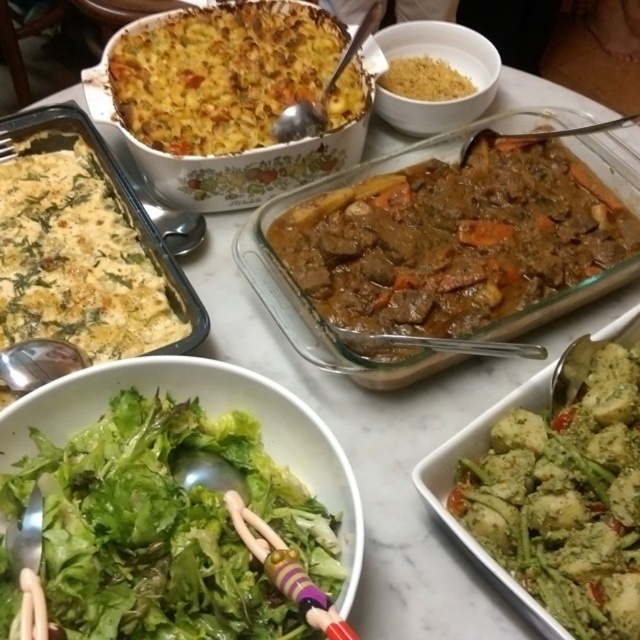
Question: Which of these objects is positioned farthest from the brown glossy stew at center?

Choices:
 (A) green leafy salad at center
 (B) yellow cheesy casserole at upper left
 (C) green pesto-coated potatoes at lower right

Answer: (A)

Question: Can you confirm if green leafy salad at center is positioned above brown crumbly at upper center?

Choices:
 (A) yes
 (B) no

Answer: (B)

Question: Can you confirm if green leafy salad at center is positioned above white creamy casserole at left?

Choices:
 (A) yes
 (B) no

Answer: (B)

Question: Among these points, which one is farthest from the camera?

Choices:
 (A) (468, 202)
 (B) (209, 108)

Answer: (B)

Question: Does green pesto-coated potatoes at lower right appear over white creamy casserole at left?

Choices:
 (A) no
 (B) yes

Answer: (A)

Question: Estimate the real-world distances between objects in this image. Which object is closer to the yellow cheesy casserole at upper left?

Choices:
 (A) white creamy casserole at left
 (B) brown crumbly at upper center
 (C) green pesto-coated potatoes at lower right

Answer: (A)